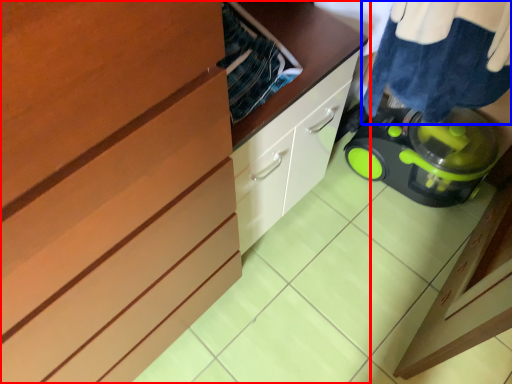
Question: Which object is further to the camera taking this photo, cabinetry (highlighted by a red box) or laundry (highlighted by a blue box)?

Choices:
 (A) cabinetry
 (B) laundry

Answer: (A)